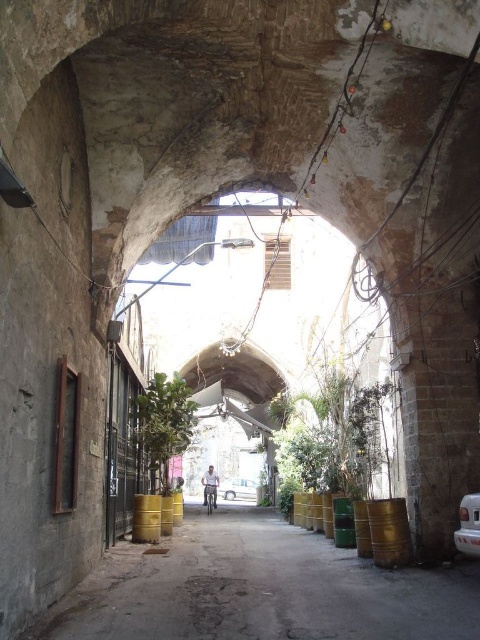
Question: Which of the following is the farthest from the observer?

Choices:
 (A) white matte van at center
 (B) gold metallic barrel at center

Answer: (B)

Question: Is concrete alley at center smaller than white matte van at center?

Choices:
 (A) yes
 (B) no

Answer: (B)

Question: Which object appears farthest from the camera in this image?

Choices:
 (A) gold metallic barrel at right
 (B) gold metallic barrel at center
 (C) metallic silver car at center

Answer: (C)

Question: Does concrete alley at center have a lesser width compared to gold metallic barrel at center?

Choices:
 (A) no
 (B) yes

Answer: (A)

Question: Which point is farther from the camera taking this photo?

Choices:
 (A) (376, 563)
 (B) (479, 577)
 (C) (247, 497)
 (D) (157, 506)

Answer: (C)

Question: Is the position of concrete alley at center more distant than that of gold metallic barrel at center?

Choices:
 (A) yes
 (B) no

Answer: (B)